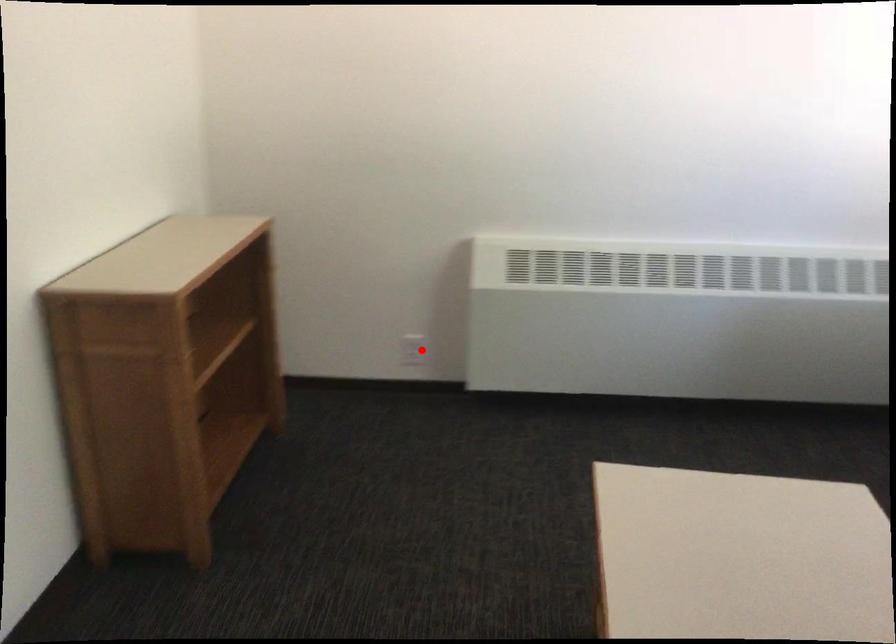
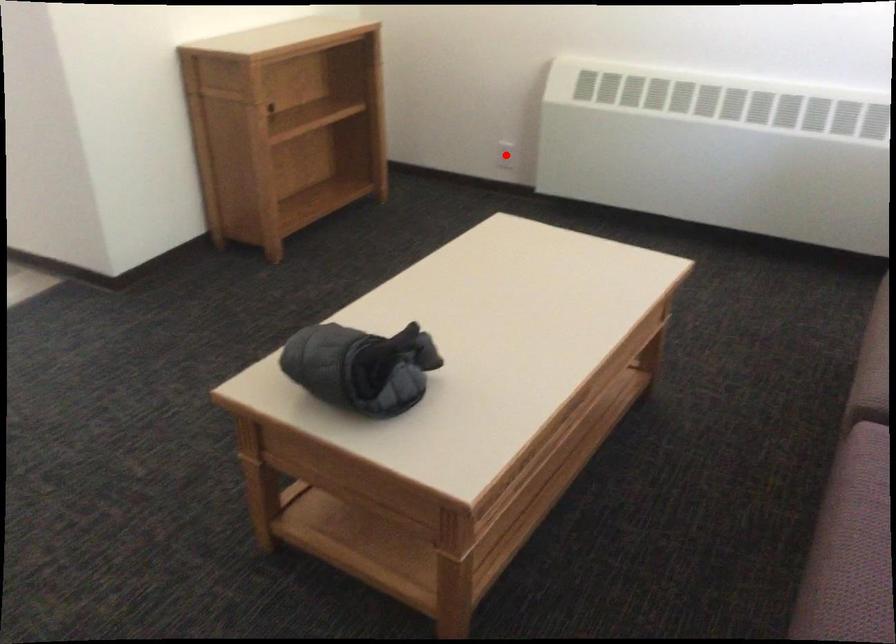
I am providing you with two images of the same scene from different viewpoints. A red point is marked on the first image and another point is marked on the second image. Does the point marked in image1 correspond to the same location as the one in image2?

Yes